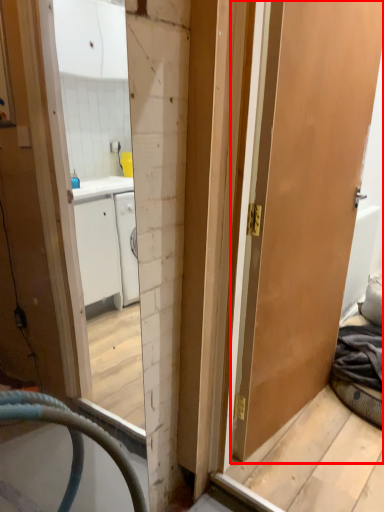
Question: Observing the image, what is the correct spatial positioning of door (annotated by the red box) in reference to radiator?

Choices:
 (A) right
 (B) left

Answer: (B)